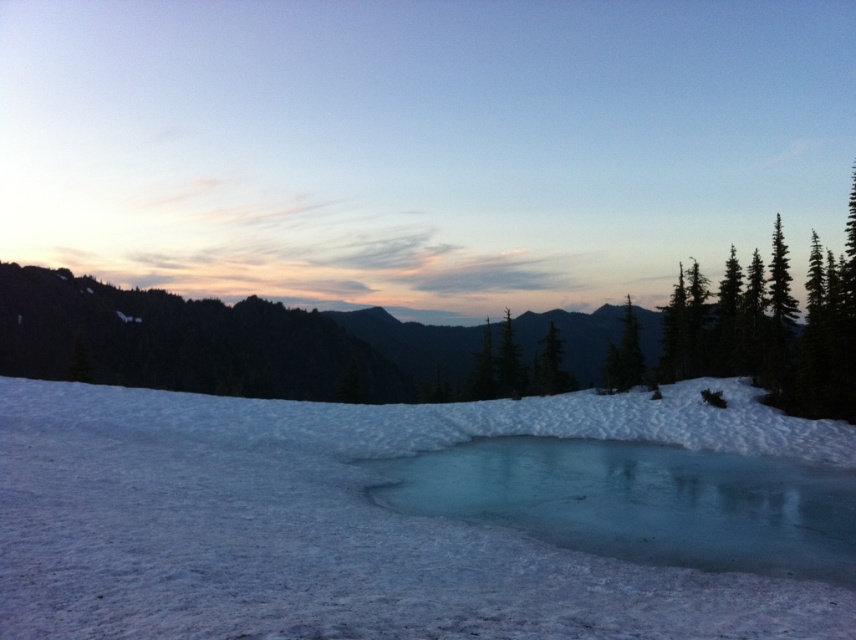
From the picture: You are a hiker who wants to cross the area where the white snow at center and translucent ice at center are located. Which surface should you avoid stepping on to stay safe?

You should avoid stepping on the translucent ice at center because the white snow at center is positioned over it, making the ice potentially unstable and dangerous to walk on.

In the scene shown: You are standing in the winter landscape and want to walk from the white snow at center to the green matte tree at center. Which direction should you move to reach the tree?

To reach the green matte tree at center from the white snow at center, you should move to the right since the white snow at center is located to the left of the green matte tree at center.